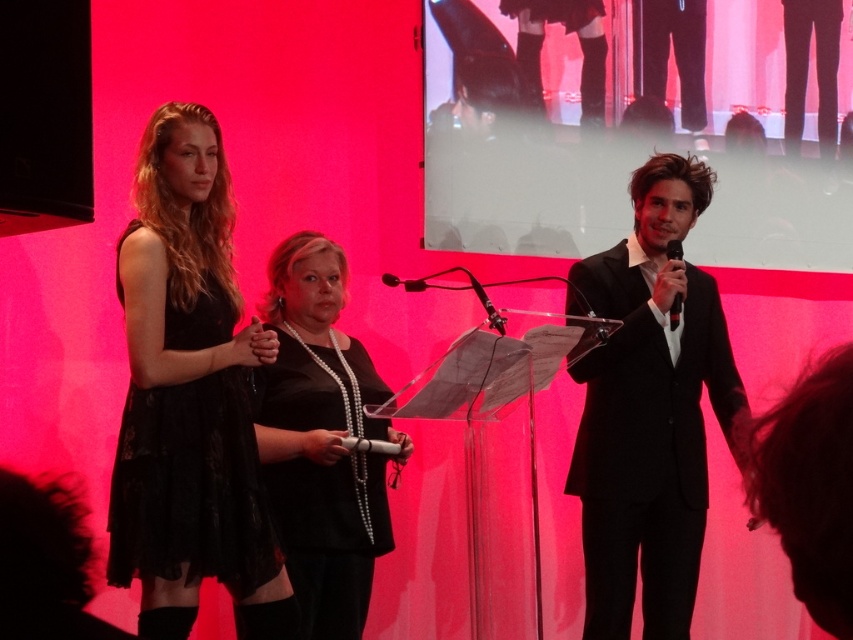
Question: Which point is farther from the camera taking this photo?

Choices:
 (A) (378, 465)
 (B) (669, 582)
 (C) (421, 276)
 (D) (668, 243)

Answer: (C)

Question: Can you confirm if black plastic microphone at right is positioned to the right of black plastic microphone at center?

Choices:
 (A) no
 (B) yes

Answer: (B)

Question: Which point is farther to the camera?

Choices:
 (A) (598, 397)
 (B) (665, 253)
 (C) (265, 580)

Answer: (B)

Question: Does black satin suit at right appear on the right side of black plastic microphone at right?

Choices:
 (A) yes
 (B) no

Answer: (B)

Question: Which object is farther from the camera taking this photo?

Choices:
 (A) lace black dress at left
 (B) black plastic microphone at center
 (C) black plastic microphone at right

Answer: (C)

Question: Can you confirm if black satin suit at right is positioned to the right of lace black dress at left?

Choices:
 (A) no
 (B) yes

Answer: (B)